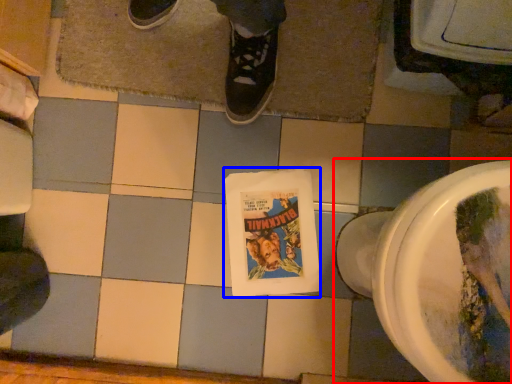
Question: Which object appears closest to the camera in this image, toilet (highlighted by a red box) or comic book (highlighted by a blue box)?

Choices:
 (A) toilet
 (B) comic book

Answer: (A)